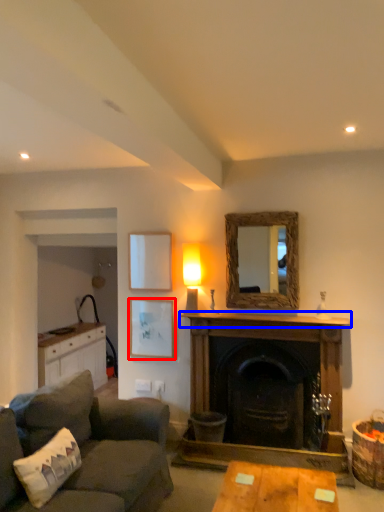
Question: Among these objects, which one is nearest to the camera, picture frame (highlighted by a red box) or mantle (highlighted by a blue box)?

Choices:
 (A) picture frame
 (B) mantle

Answer: (B)